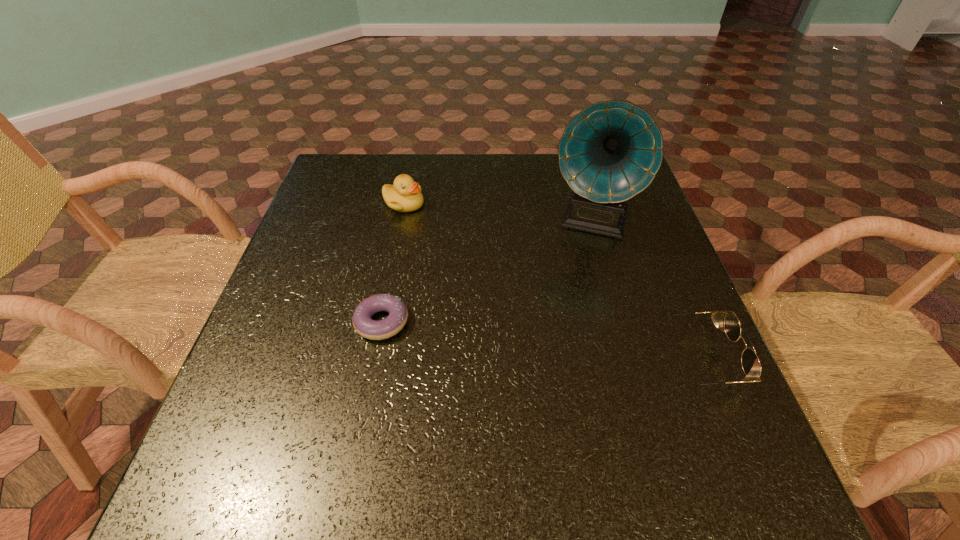
Locate an element on the screen. Image resolution: width=960 pixels, height=540 pixels. blank space at the left edge of the desktop is located at coordinates (311, 345).

In the image, there is a desktop. Identify the location of vacant space at the right edge. (639, 276).

In order to click on vacant position at the far left corner of the desktop in this screenshot , I will do `click(348, 156)`.

In the image, there is a desktop. At what (x,y) coordinates should I click in order to perform the action: click on vacant space at the near left corner. Please return your answer as a coordinate pair (x, y). Looking at the image, I should click on (245, 430).

Identify the location of free region at the near right corner of the desktop. (700, 400).

Locate an element on the screen. This screenshot has width=960, height=540. free space between the sunglasses and the shortest object is located at coordinates (539, 341).

At what (x,y) coordinates should I click in order to perform the action: click on vacant region between the doughnut and the tallest object. Please return your answer as a coordinate pair (x, y). This screenshot has height=540, width=960. Looking at the image, I should click on (x=486, y=271).

Identify the location of free spot between the sunglasses and the doughnut. This screenshot has width=960, height=540. (539, 341).

You are a GUI agent. You are given a task and a screenshot of the screen. Output one action in this format:
    pyautogui.click(x=<x>, y=<y>)
    Task: Click on the vacant region between the phonograph_record and the sunglasses
    Image resolution: width=960 pixels, height=540 pixels.
    Given the screenshot: What is the action you would take?
    pyautogui.click(x=642, y=290)

At what (x,y) coordinates should I click in order to perform the action: click on empty location between the phonograph_record and the sunglasses. Please return your answer as a coordinate pair (x, y). The height and width of the screenshot is (540, 960). Looking at the image, I should click on (642, 290).